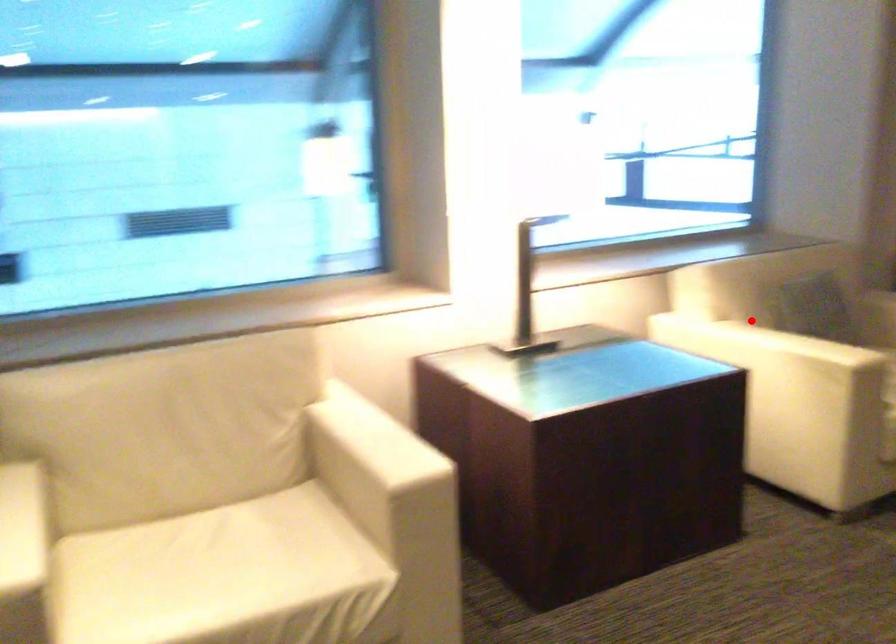
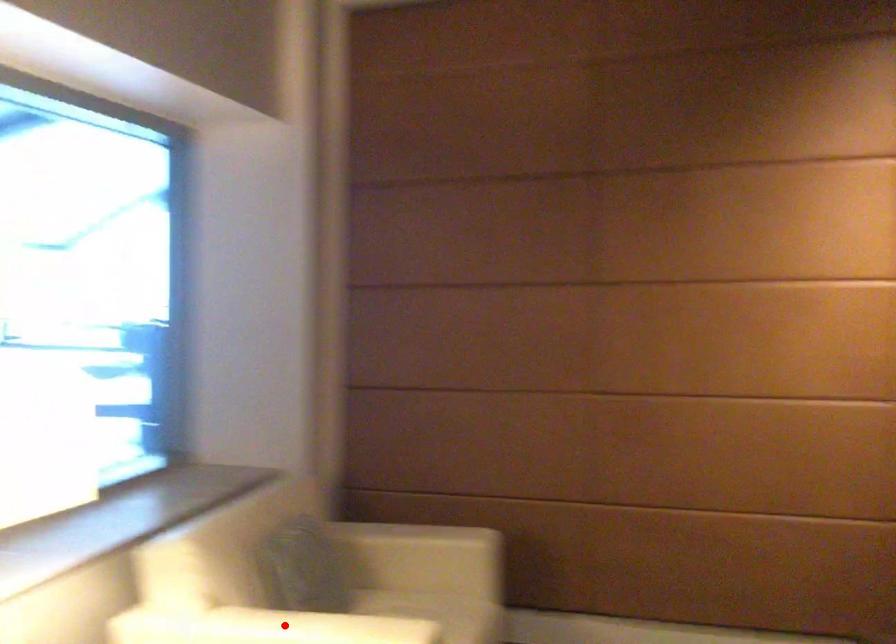
I am providing you with two images of the same scene from different viewpoints. A red point is marked on the first image and another point is marked on the second image. Is the red point in image1 aligned with the point shown in image2?

Yes